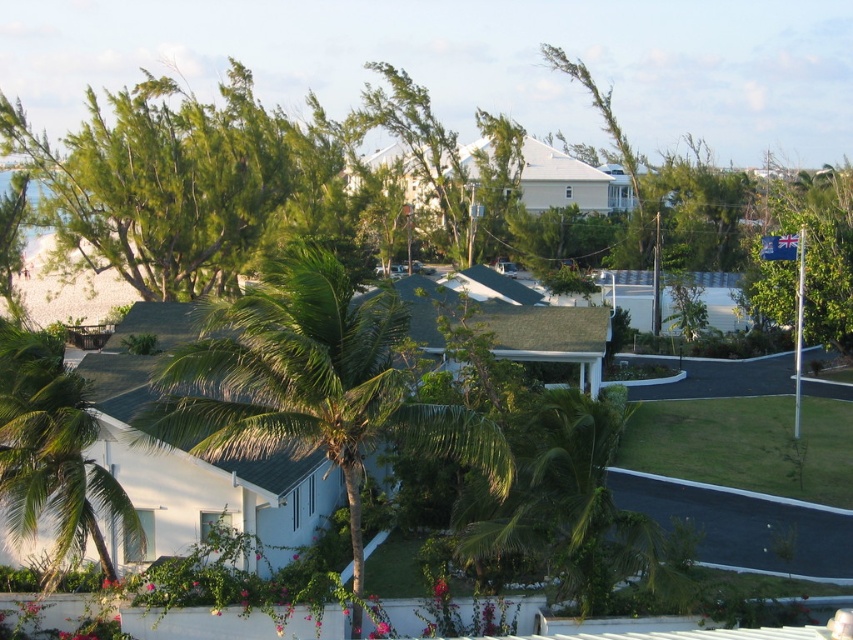
Question: Can you confirm if green leafy palm tree at center is positioned to the left of green leafy palm tree at lower left?

Choices:
 (A) no
 (B) yes

Answer: (A)

Question: Which of the following is the farthest from the observer?

Choices:
 (A) (91, 426)
 (B) (364, 374)

Answer: (A)

Question: Among these objects, which one is nearest to the camera?

Choices:
 (A) green leafy palm tree at center
 (B) green leafy palm tree at lower left

Answer: (A)

Question: Does green leafy palm tree at center lie behind green leafy palm tree at lower left?

Choices:
 (A) yes
 (B) no

Answer: (B)

Question: Does green leafy palm tree at center have a lesser width compared to green leafy palm tree at lower left?

Choices:
 (A) no
 (B) yes

Answer: (A)